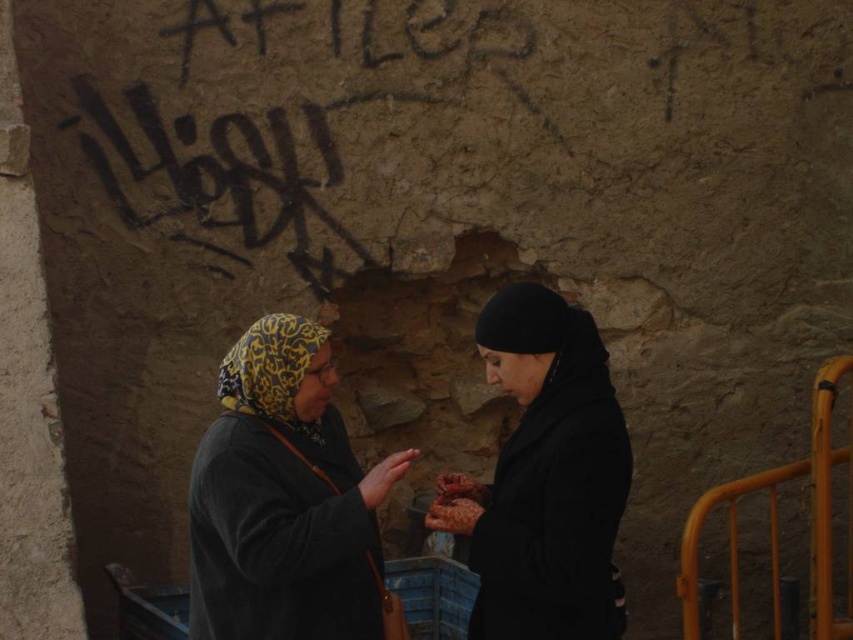
Is yellow printed headscarf at center shorter than black matte coat at center?

Yes.

This screenshot has height=640, width=853. What do you see at coordinates (285, 500) in the screenshot?
I see `yellow printed headscarf at center` at bounding box center [285, 500].

This screenshot has width=853, height=640. Find the location of `yellow printed headscarf at center`. yellow printed headscarf at center is located at coordinates (285, 500).